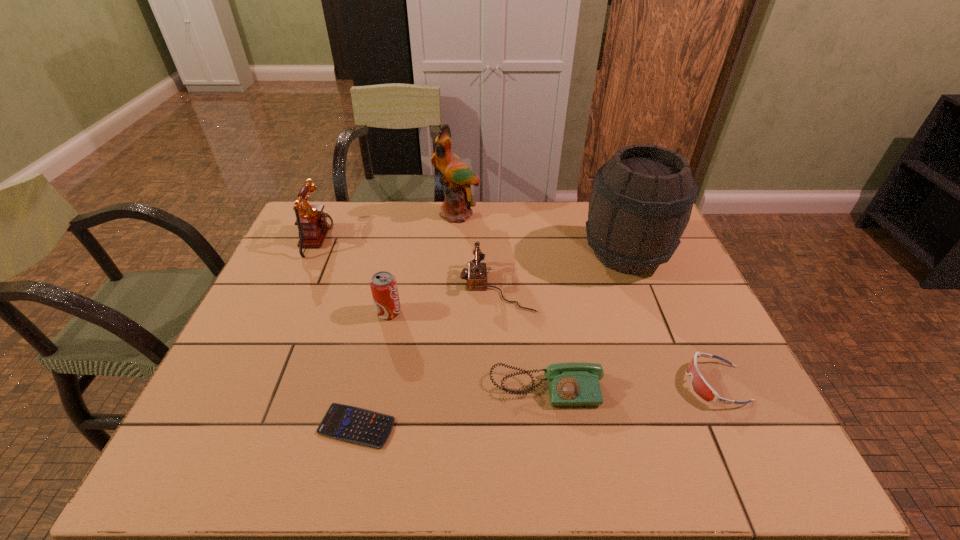
You are a GUI agent. You are given a task and a screenshot of the screen. Output one action in this format:
    pyautogui.click(x=<x>, y=<y>)
    Task: Click on the calculator
    
    Given the screenshot: What is the action you would take?
    pyautogui.click(x=348, y=423)

I want to click on free point located on the front-facing side of the parrot, so (x=456, y=235).

The height and width of the screenshot is (540, 960). What are the coordinates of `vacant space positioned 0.330m on the left of the wine bucket` in the screenshot? It's located at (476, 254).

Find the location of a particular element. vacant space located 0.130m on the dial of the third tallest object is located at coordinates (374, 240).

The image size is (960, 540). Identify the location of free region located on the left of the fifth shortest object. (262, 312).

Identify the location of free spot located on the dial of the second nearest telephone. Image resolution: width=960 pixels, height=540 pixels. (367, 286).

Identify the location of vacant space located 0.190m on the dial of the second nearest telephone. The width and height of the screenshot is (960, 540). (395, 286).

Where is `free space located on the dial of the second nearest telephone`? free space located on the dial of the second nearest telephone is located at coordinates (335, 286).

You are a GUI agent. You are given a task and a screenshot of the screen. Output one action in this format:
    pyautogui.click(x=<x>, y=<y>)
    Task: Click on the vacant space located 0.110m on the dial of the nearest telephone
    Image resolution: width=960 pixels, height=540 pixels.
    Given the screenshot: What is the action you would take?
    pyautogui.click(x=555, y=456)

At what (x,y) coordinates should I click in order to perform the action: click on free spot located 0.270m on the front-facing side of the goggles. Please return your answer as a coordinate pair (x, y). The image size is (960, 540). Looking at the image, I should click on (570, 383).